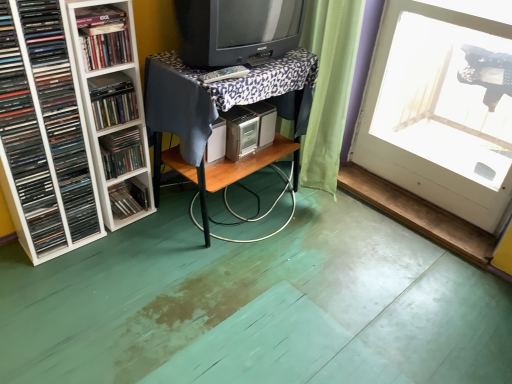
In order to click on vacant space in front of white plastic shelf at left, the 3th book positioned from the bottom in this screenshot , I will do `click(47, 281)`.